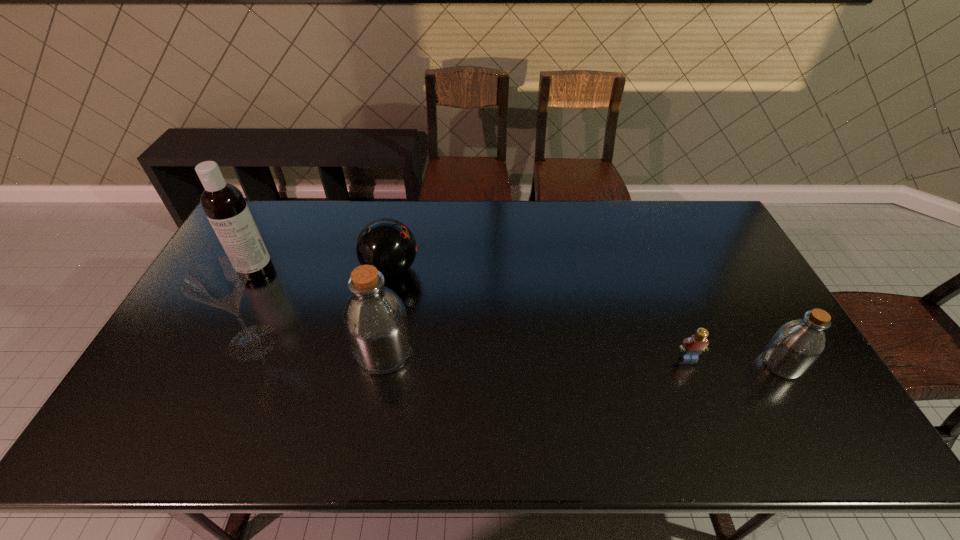
To ensure equal spacing by inserting another bottle among them, please point out a vacant spot for this new bottle. Please provide its 2D coordinates. Your answer should be formatted as a tuple, i.e. [(x, y)], where the tuple contains the x and y coordinates of a point satisfying the conditions above.

[(581, 358)]